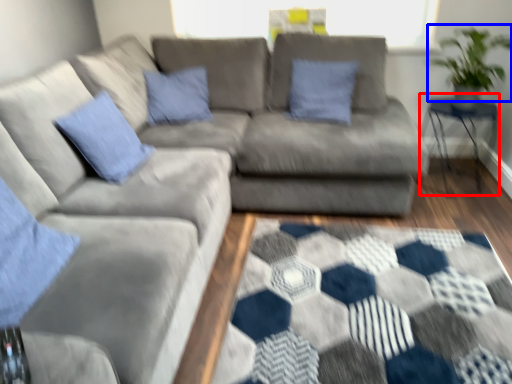
Question: Among these objects, which one is nearest to the camera, table (highlighted by a red box) or plant (highlighted by a blue box)?

Choices:
 (A) table
 (B) plant

Answer: (B)